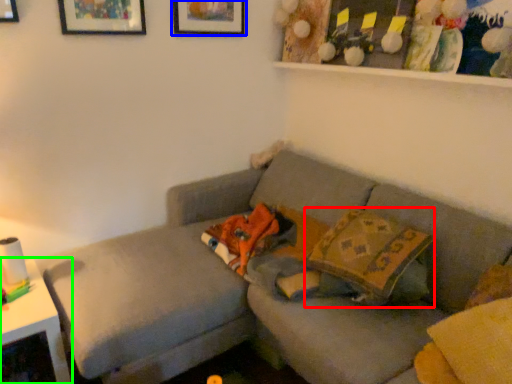
Question: Considering the real-world distances, which object is closest to throw pillow (highlighted by a red box)? picture frame (highlighted by a blue box) or table (highlighted by a green box).

Choices:
 (A) picture frame
 (B) table

Answer: (B)